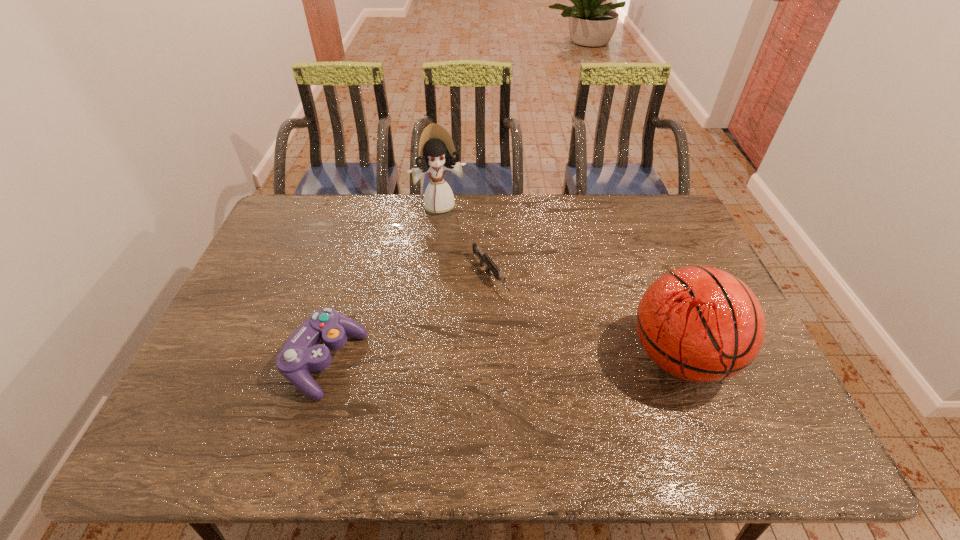
Locate an element on the screen. The height and width of the screenshot is (540, 960). vacant spot on the desktop that is between the third tallest object and the basketball and is positioned at the front face of the farthest object is located at coordinates (491, 360).

Find the location of a particular element. The image size is (960, 540). vacant spot on the desktop that is between the third tallest object and the rightmost object and is positioned aimed along the barrel of the second object from right to left is located at coordinates (555, 359).